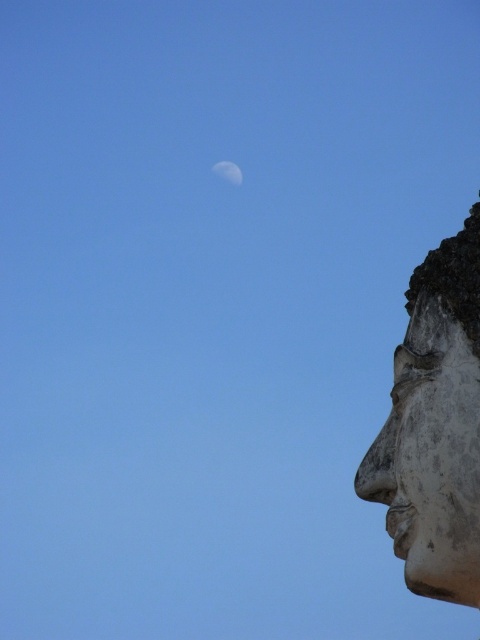
Looking at this image, can you confirm if white stone face at right is positioned below white glossy moon at upper center?

Yes, white stone face at right is below white glossy moon at upper center.

Is white stone face at right shorter than white glossy moon at upper center?

No.

This screenshot has width=480, height=640. I want to click on white stone face at right, so click(431, 458).

You are a GUI agent. You are given a task and a screenshot of the screen. Output one action in this format:
    pyautogui.click(x=<x>, y=<y>)
    Task: Click on the white stone face at right
    This screenshot has height=640, width=480.
    Given the screenshot: What is the action you would take?
    pyautogui.click(x=431, y=458)